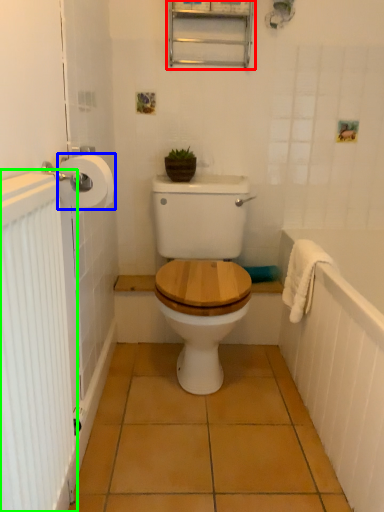
Question: Estimate the real-world distances between objects in this image. Which object is farther from medicine cabinet (highlighted by a red box), toilet paper (highlighted by a blue box) or radiator (highlighted by a green box)?

Choices:
 (A) toilet paper
 (B) radiator

Answer: (B)